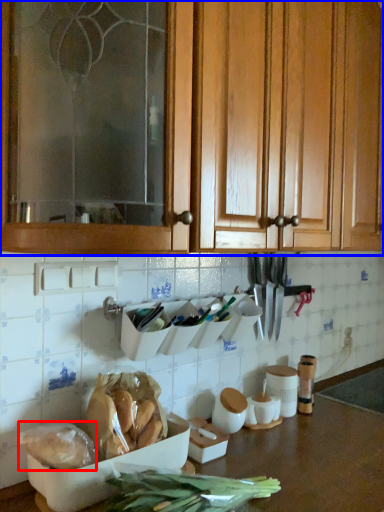
Question: Which point is closer to the camera, food (highlighted by a red box) or cabinetry (highlighted by a blue box)?

Choices:
 (A) food
 (B) cabinetry

Answer: (B)